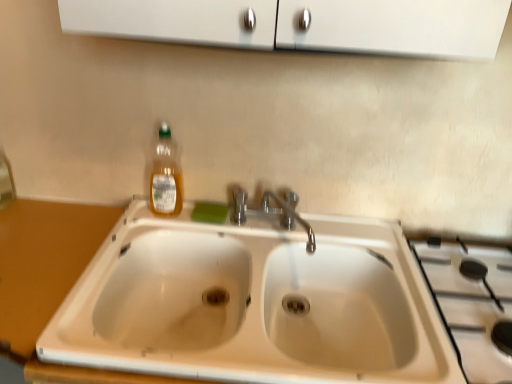
Question: Should I look upward or downward to see translucent plastic bottle at upper left?

Choices:
 (A) up
 (B) down

Answer: (A)

Question: Can you confirm if wooden counter at lower left is smaller than green sponge at sink?

Choices:
 (A) no
 (B) yes

Answer: (A)

Question: From the image's perspective, is wooden counter at lower left beneath green sponge at sink?

Choices:
 (A) no
 (B) yes

Answer: (B)

Question: Is wooden counter at lower left in front of green sponge at sink?

Choices:
 (A) yes
 (B) no

Answer: (A)

Question: From a real-world perspective, is wooden counter at lower left beneath green sponge at sink?

Choices:
 (A) yes
 (B) no

Answer: (A)

Question: Considering the relative sizes of wooden counter at lower left and green sponge at sink in the image provided, is wooden counter at lower left thinner than green sponge at sink?

Choices:
 (A) no
 (B) yes

Answer: (A)

Question: Is wooden counter at lower left facing away from green sponge at sink?

Choices:
 (A) no
 (B) yes

Answer: (A)

Question: Are white ceramic gas stove at right and wooden counter at lower left making contact?

Choices:
 (A) no
 (B) yes

Answer: (A)

Question: Could you tell me if white ceramic gas stove at right is facing wooden counter at lower left?

Choices:
 (A) yes
 (B) no

Answer: (B)

Question: From a real-world perspective, is white ceramic gas stove at right on wooden counter at lower left?

Choices:
 (A) yes
 (B) no

Answer: (A)

Question: Would you say white ceramic gas stove at right is outside wooden counter at lower left?

Choices:
 (A) yes
 (B) no

Answer: (A)

Question: Is white ceramic gas stove at right at the left side of wooden counter at lower left?

Choices:
 (A) yes
 (B) no

Answer: (B)

Question: Is white ceramic gas stove at right in front of wooden counter at lower left?

Choices:
 (A) no
 (B) yes

Answer: (A)

Question: Considering the relative sizes of translucent plastic bottle at upper left and white ceramic sink at center in the image provided, is translucent plastic bottle at upper left bigger than white ceramic sink at center?

Choices:
 (A) no
 (B) yes

Answer: (A)